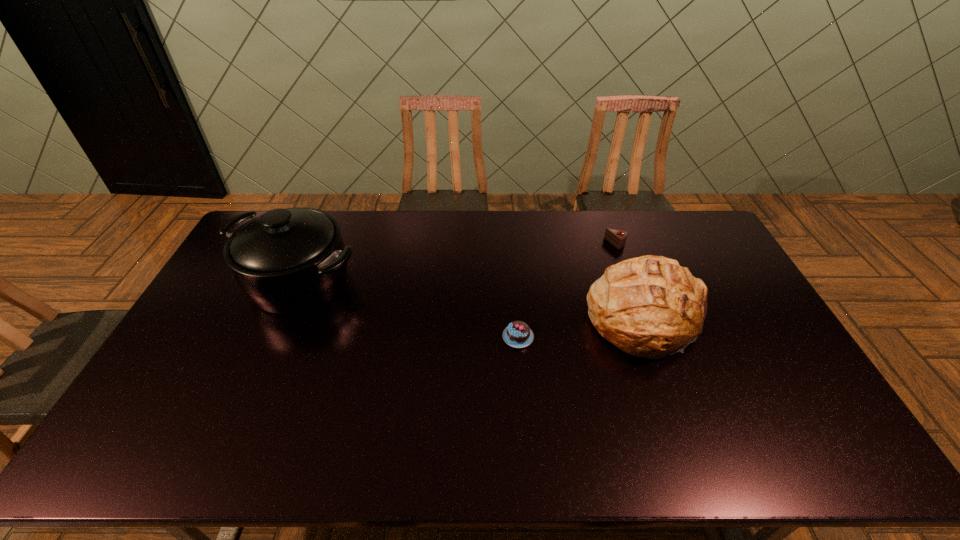
Locate an element on the screen. The width and height of the screenshot is (960, 540). saucepan that is at the far edge is located at coordinates (287, 261).

Locate an element on the screen. The image size is (960, 540). chocolate cake that is at the far edge is located at coordinates (617, 238).

The height and width of the screenshot is (540, 960). I want to click on object located at the left edge, so click(287, 261).

At what (x,y) coordinates should I click in order to perform the action: click on object that is at the far left corner. Please return your answer as a coordinate pair (x, y). The image size is (960, 540). Looking at the image, I should click on (287, 261).

At what (x,y) coordinates should I click in order to perform the action: click on free space at the far edge. Please return your answer as a coordinate pair (x, y). Looking at the image, I should click on (329, 211).

This screenshot has width=960, height=540. In the image, there is a desktop. In order to click on free space at the near edge in this screenshot , I will do `click(682, 438)`.

Identify the location of free space at the left edge. (160, 414).

Where is `free space at the right edge of the desktop`? free space at the right edge of the desktop is located at coordinates (704, 277).

I want to click on free region at the far right corner of the desktop, so click(703, 217).

At what (x,y) coordinates should I click in order to perform the action: click on free space between the bread and the second object from left to right. Please return your answer as a coordinate pair (x, y). Looking at the image, I should click on (583, 328).